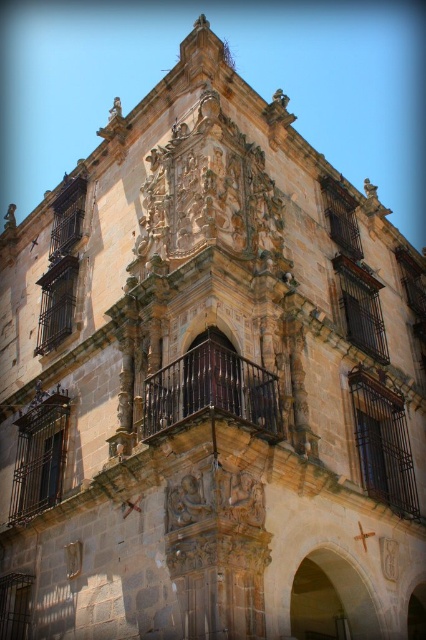
Question: Which point is farther from the camera taking this photo?

Choices:
 (A) click(397, 545)
 (B) click(199, 385)

Answer: (A)

Question: Can you confirm if dark brown wrought iron balcony at center is positioned below white matte clock at center?

Choices:
 (A) yes
 (B) no

Answer: (B)

Question: Which object is farther from the camera taking this photo?

Choices:
 (A) dark brown wrought iron balcony at center
 (B) white matte clock at center

Answer: (B)

Question: Is dark brown wrought iron balcony at center thinner than white matte clock at center?

Choices:
 (A) yes
 (B) no

Answer: (B)

Question: Can you confirm if dark brown wrought iron balcony at center is thinner than white matte clock at center?

Choices:
 (A) yes
 (B) no

Answer: (B)